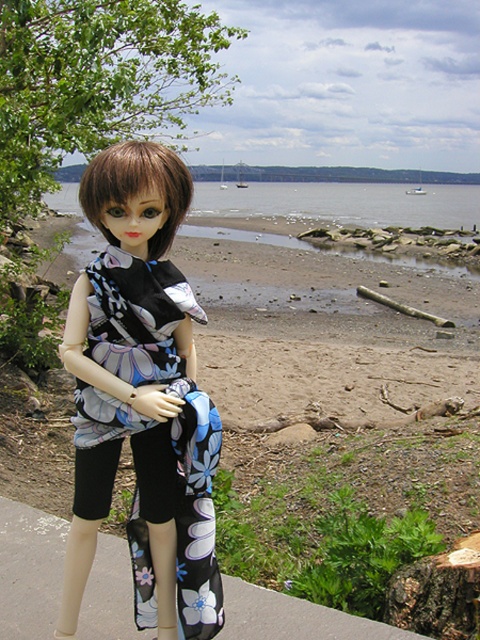
You are a hiker who wants to cross from the clear water at beach center to the brown wood stump at lower right. Can you safely walk between them without getting wet?

The clear water at beach center and brown wood stump at lower right are 38.35 meters apart. Since the distance is quite large, you might get wet if you try to walk between them, so it might not be safe.

You are standing on the beach and want to place a small flag exactly between the clear water at beach center and the brown wood stump at lower right. Which object should you use as your starting point to walk towards the other to place the flag correctly?

You should start at the brown wood stump at lower right and walk towards the clear water at beach center to place the flag exactly between them, since the clear water at beach center is to the right of the brown wood stump at lower right.